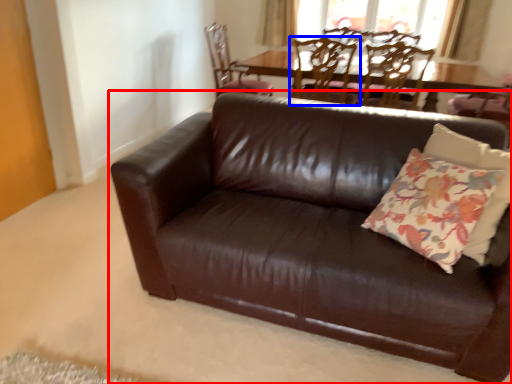
Question: Which of the following is the farthest to the observer, studio couch (highlighted by a red box) or chair (highlighted by a blue box)?

Choices:
 (A) studio couch
 (B) chair

Answer: (B)